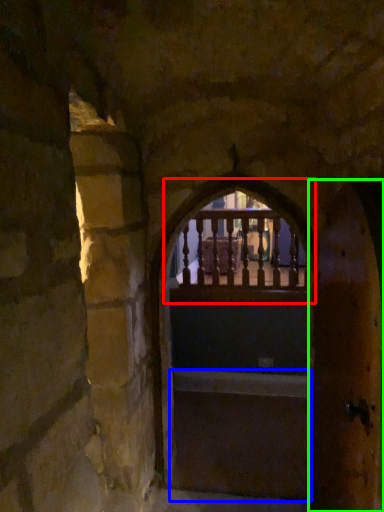
Question: Which is nearer to the window (highlighted by a red box)? stairs (highlighted by a blue box) or door (highlighted by a green box).

Choices:
 (A) stairs
 (B) door

Answer: (A)